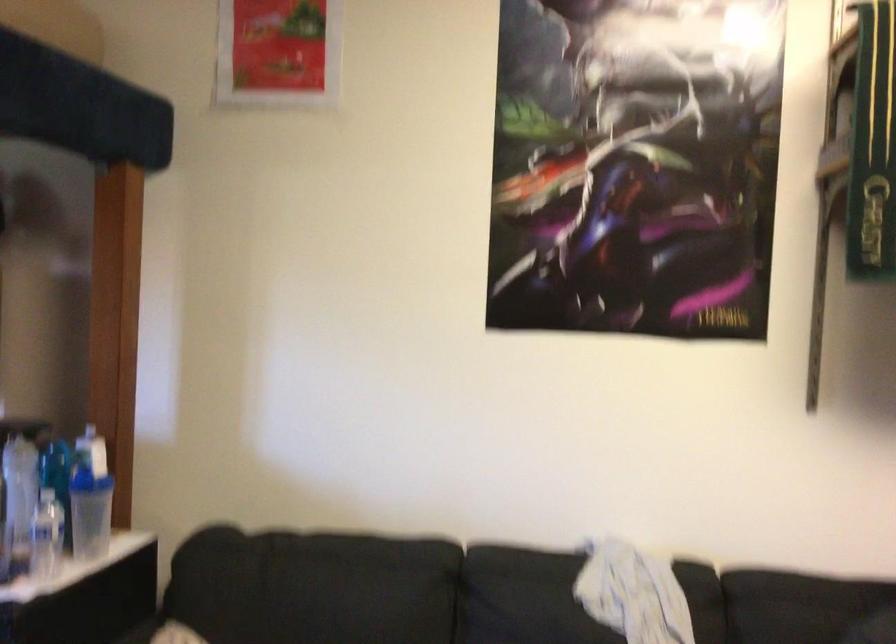
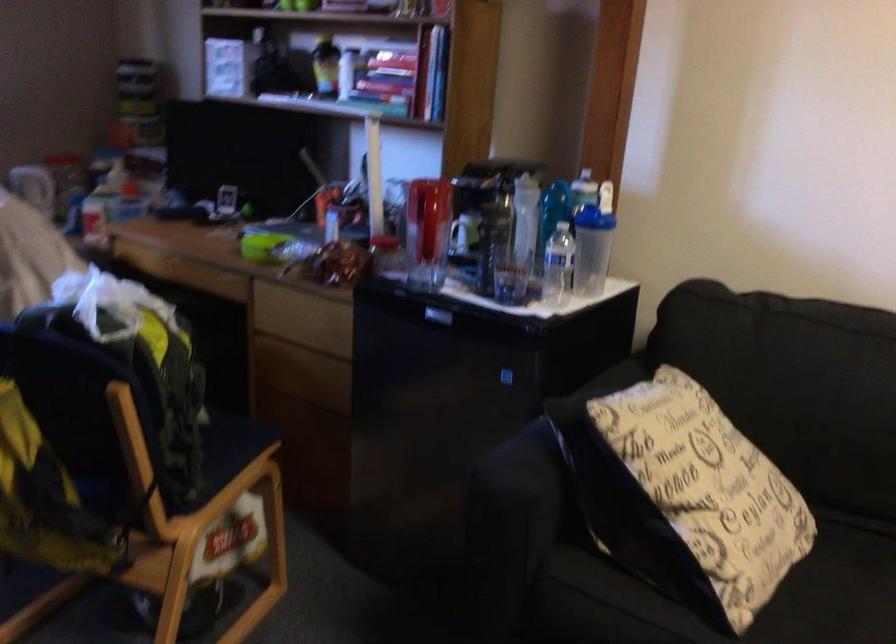
Question: What movement of the cameraman would produce the second image?

Choices:
 (A) Left
 (B) Right
 (C) Forward
 (D) Backward

Answer: (A)